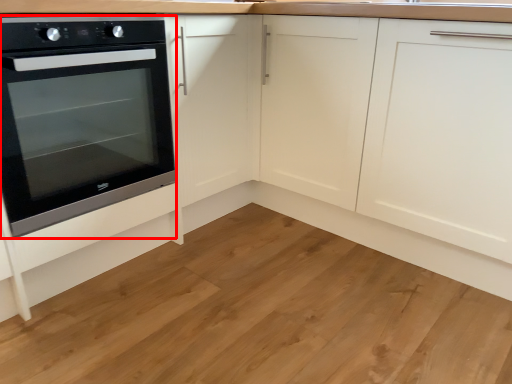
Question: From the image's perspective, what is the correct spatial positioning of oven (annotated by the red box) in reference to hardwood?

Choices:
 (A) above
 (B) below

Answer: (A)